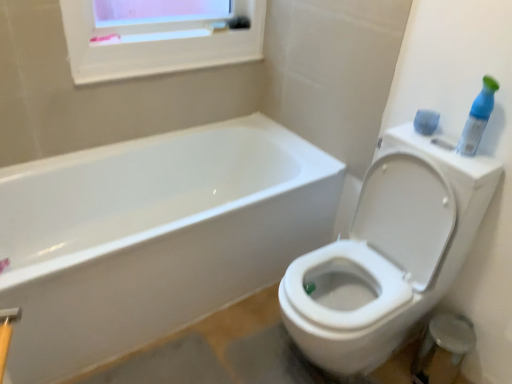
Question: From a real-world perspective, is white glossy toilet at right positioned above or below blue plastic spray bottle at upper right?

Choices:
 (A) above
 (B) below

Answer: (B)

Question: Is white glossy toilet at right in front of or behind blue plastic spray bottle at upper right in the image?

Choices:
 (A) behind
 (B) front

Answer: (B)

Question: In terms of width, does white glossy toilet at right look wider or thinner when compared to blue plastic spray bottle at upper right?

Choices:
 (A) wide
 (B) thin

Answer: (A)

Question: Is point coord(483,77) closer or farther from the camera than point coord(287,279)?

Choices:
 (A) closer
 (B) farther

Answer: (A)

Question: Visually, is blue plastic spray bottle at upper right positioned to the left or to the right of white glossy toilet at right?

Choices:
 (A) left
 (B) right

Answer: (B)

Question: In terms of height, does blue plastic spray bottle at upper right look taller or shorter compared to white glossy toilet at right?

Choices:
 (A) tall
 (B) short

Answer: (B)

Question: From a real-world perspective, relative to white glossy toilet at right, is blue plastic spray bottle at upper right vertically above or below?

Choices:
 (A) below
 (B) above

Answer: (B)